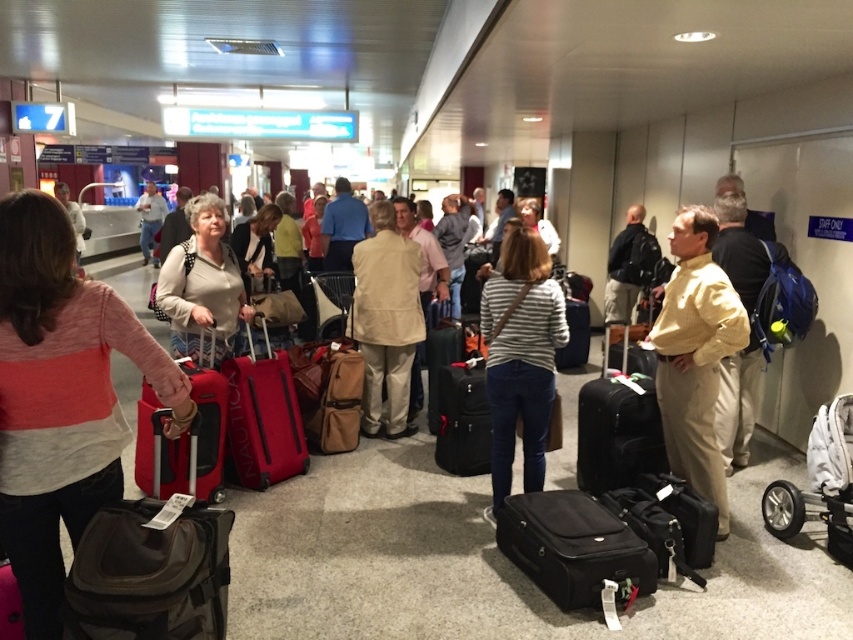
Who is lower down, striped sweater at left or matte beige jacket at center?

striped sweater at left

What are the coordinates of `striped sweater at left` in the screenshot? It's located at (61, 397).

At what (x,y) coordinates should I click in order to perform the action: click on striped sweater at left. Please return your answer as a coordinate pair (x, y). The width and height of the screenshot is (853, 640). Looking at the image, I should click on (61, 397).

From the picture: Does striped cotton shirt at center come behind black leather suitcase at lower right?

Yes, striped cotton shirt at center is behind black leather suitcase at lower right.

Is point (502, 376) farther from camera compared to point (669, 486)?

Yes, point (502, 376) is farther from viewer.

You are a GUI agent. You are given a task and a screenshot of the screen. Output one action in this format:
    pyautogui.click(x=<x>, y=<y>)
    Task: Click on the striped cotton shirt at center
    The width and height of the screenshot is (853, 640).
    Given the screenshot: What is the action you would take?
    pyautogui.click(x=520, y=358)

Which is behind, point (366, 408) or point (9, 570)?

Positioned behind is point (366, 408).

Is point (402, 292) farther from viewer compared to point (18, 604)?

Yes, it is behind point (18, 604).

Locate an element on the screen. This screenshot has height=640, width=853. beige fabric coat at center is located at coordinates pos(386,321).